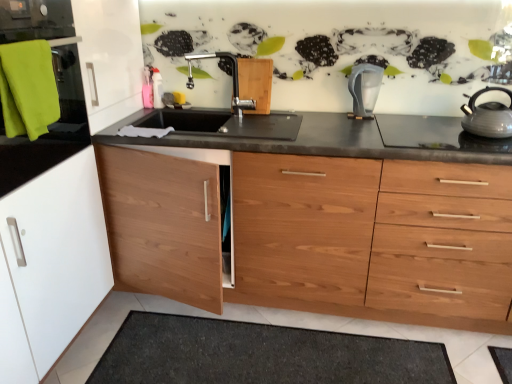
Question: Is transparent plastic water filter at center further to the viewer compared to shiny silver gas stove at right?

Choices:
 (A) yes
 (B) no

Answer: (A)

Question: Considering the relative positions of transparent plastic water filter at center and shiny silver gas stove at right in the image provided, is transparent plastic water filter at center to the right of shiny silver gas stove at right from the viewer's perspective?

Choices:
 (A) no
 (B) yes

Answer: (A)

Question: Is transparent plastic water filter at center closer to the viewer compared to shiny silver gas stove at right?

Choices:
 (A) yes
 (B) no

Answer: (B)

Question: Is transparent plastic water filter at center oriented towards shiny silver gas stove at right?

Choices:
 (A) yes
 (B) no

Answer: (B)

Question: Is transparent plastic water filter at center beside shiny silver gas stove at right?

Choices:
 (A) yes
 (B) no

Answer: (B)

Question: From the image's perspective, is transparent plastic water filter at center located above or below matte silver faucet at center?

Choices:
 (A) below
 (B) above

Answer: (A)

Question: In terms of width, does transparent plastic water filter at center look wider or thinner when compared to matte silver faucet at center?

Choices:
 (A) wide
 (B) thin

Answer: (A)

Question: Considering their positions, is transparent plastic water filter at center located in front of or behind matte silver faucet at center?

Choices:
 (A) front
 (B) behind

Answer: (B)

Question: Is transparent plastic water filter at center taller or shorter than matte silver faucet at center?

Choices:
 (A) short
 (B) tall

Answer: (A)

Question: Is shiny silver gas stove at right spatially inside black matte sink at center, or outside of it?

Choices:
 (A) inside
 (B) outside

Answer: (B)

Question: From the image's perspective, is shiny silver gas stove at right located above or below black matte sink at center?

Choices:
 (A) above
 (B) below

Answer: (B)

Question: Visually, is shiny silver gas stove at right positioned to the left or to the right of black matte sink at center?

Choices:
 (A) left
 (B) right

Answer: (B)

Question: Considering their positions, is shiny silver gas stove at right located in front of or behind black matte sink at center?

Choices:
 (A) behind
 (B) front

Answer: (B)

Question: Visually, is matte silver faucet at center positioned to the left or to the right of black granite countertop at center?

Choices:
 (A) right
 (B) left

Answer: (B)

Question: From a real-world perspective, is matte silver faucet at center positioned above or below black granite countertop at center?

Choices:
 (A) above
 (B) below

Answer: (A)